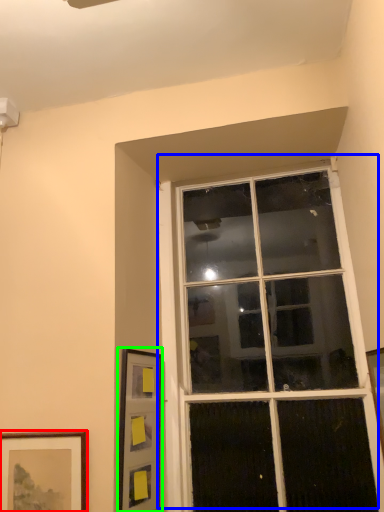
Question: Based on their relative distances, which object is nearer to picture frame (highlighted by a red box)? Choose from window (highlighted by a blue box) and picture frame (highlighted by a green box).

Choices:
 (A) window
 (B) picture frame

Answer: (B)